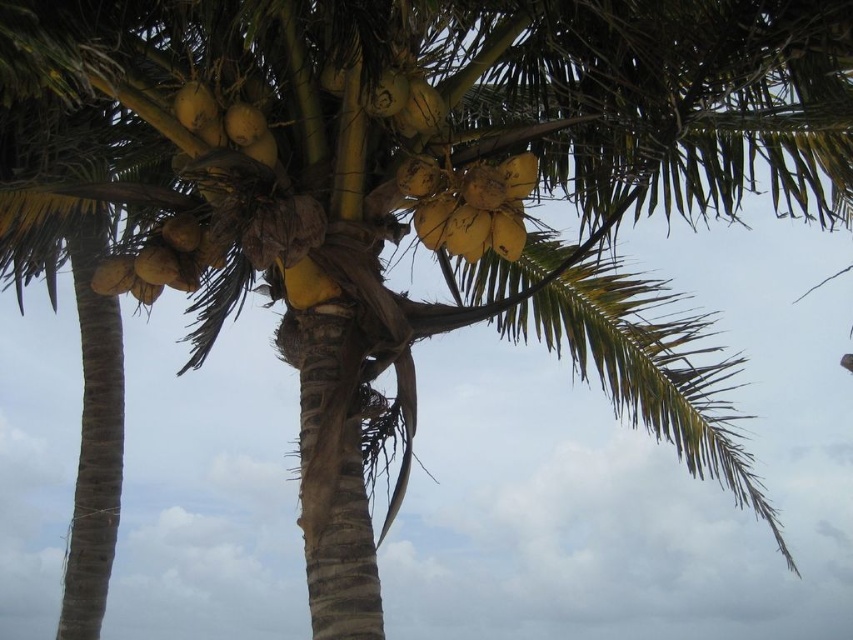
Does yellow matte coconut at upper center appear on the left side of yellow matte coconuts at center?

In fact, yellow matte coconut at upper center is to the right of yellow matte coconuts at center.

You are a GUI agent. You are given a task and a screenshot of the screen. Output one action in this format:
    pyautogui.click(x=<x>, y=<y>)
    Task: Click on the yellow matte coconut at upper center
    
    Given the screenshot: What is the action you would take?
    pyautogui.click(x=469, y=204)